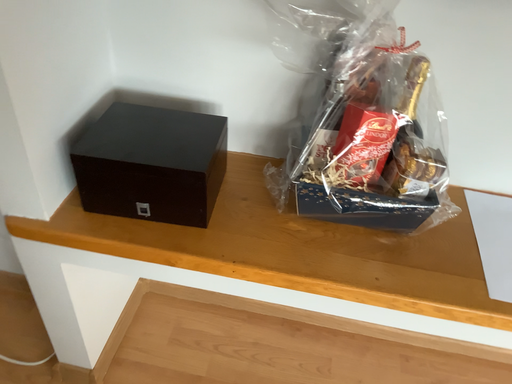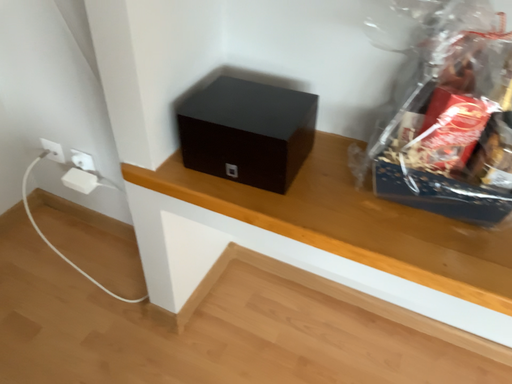
Question: How did the camera likely rotate when shooting the video?

Choices:
 (A) rotated right
 (B) rotated left

Answer: (B)